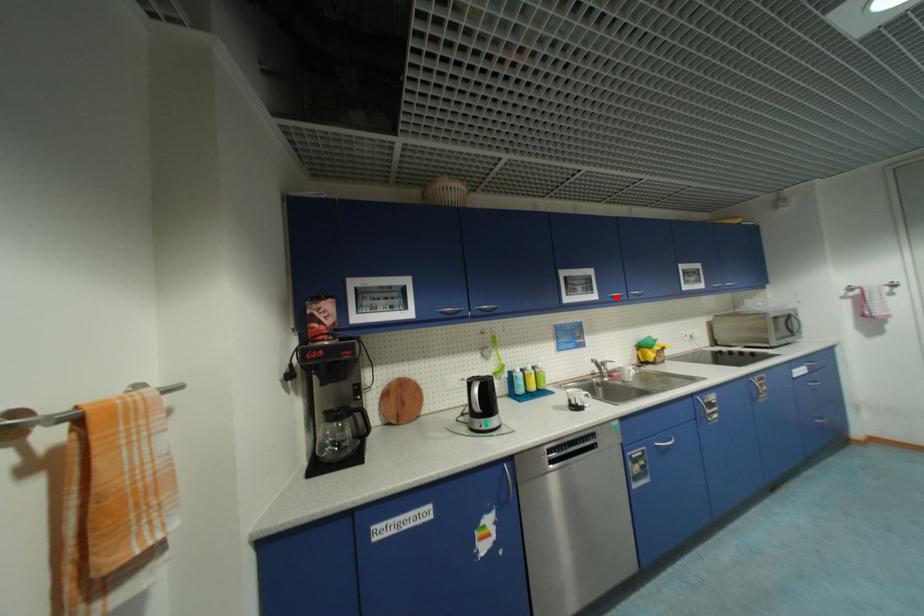
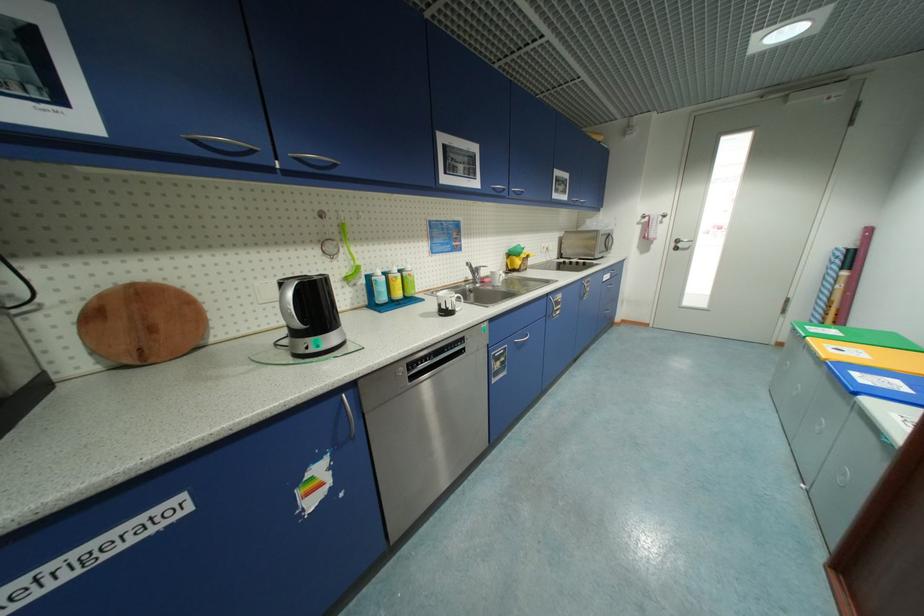
Locate, in the second image, the point that corresponds to the highlighted location in the first image.

(499, 190)